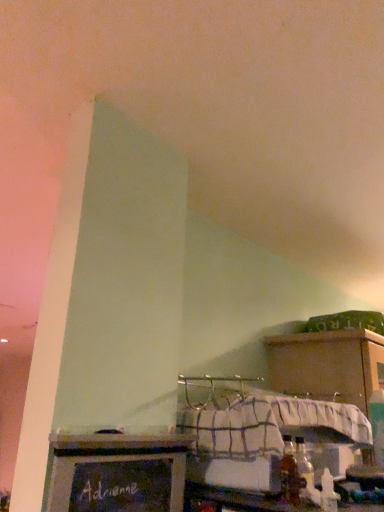
Question: From the image's perspective, does chalkboard sign at lower center appear higher than wooden at upper right?

Choices:
 (A) no
 (B) yes

Answer: (B)

Question: Considering the relative sizes of chalkboard sign at lower center and wooden at upper right in the image provided, is chalkboard sign at lower center wider than wooden at upper right?

Choices:
 (A) no
 (B) yes

Answer: (A)

Question: Can you confirm if chalkboard sign at lower center is bigger than wooden at upper right?

Choices:
 (A) no
 (B) yes

Answer: (A)

Question: Is the surface of chalkboard sign at lower center in direct contact with wooden at upper right?

Choices:
 (A) no
 (B) yes

Answer: (A)

Question: Is chalkboard sign at lower center closer to the viewer compared to wooden at upper right?

Choices:
 (A) no
 (B) yes

Answer: (B)

Question: Is there a large distance between chalkboard sign at lower center and wooden at upper right?

Choices:
 (A) yes
 (B) no

Answer: (B)

Question: Is wooden at upper right thinner than chalkboard sign at lower center?

Choices:
 (A) yes
 (B) no

Answer: (B)

Question: Can you confirm if wooden at upper right is wider than chalkboard sign at lower center?

Choices:
 (A) yes
 (B) no

Answer: (A)

Question: Is wooden at upper right to the left of chalkboard sign at lower center from the viewer's perspective?

Choices:
 (A) no
 (B) yes

Answer: (A)

Question: Can you confirm if wooden at upper right is taller than chalkboard sign at lower center?

Choices:
 (A) no
 (B) yes

Answer: (B)

Question: From the image's perspective, is wooden at upper right on top of chalkboard sign at lower center?

Choices:
 (A) yes
 (B) no

Answer: (B)

Question: Can we say wooden at upper right lies outside chalkboard sign at lower center?

Choices:
 (A) no
 (B) yes

Answer: (B)

Question: From a real-world perspective, is chalkboard sign at lower center positioned above or below wooden at upper right?

Choices:
 (A) below
 (B) above

Answer: (A)